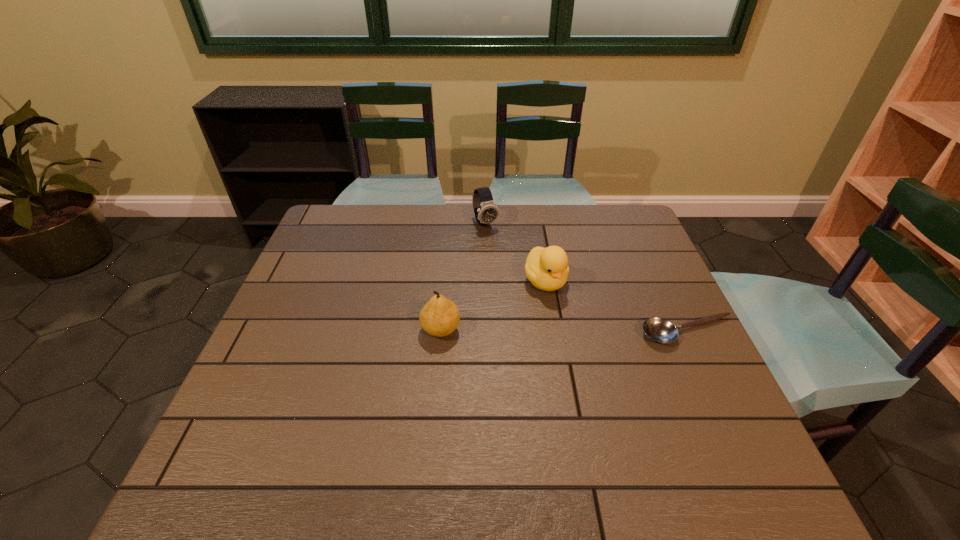
This screenshot has width=960, height=540. I want to click on blank space at the right edge of the desktop, so click(x=706, y=376).

In the image, there is a desktop. Where is `vacant region at the far right corner`? The width and height of the screenshot is (960, 540). vacant region at the far right corner is located at coordinates (618, 211).

At what (x,y) coordinates should I click in order to perform the action: click on free area in between the third object from left to right and the farthest object. Please return your answer as a coordinate pair (x, y). This screenshot has width=960, height=540. Looking at the image, I should click on (516, 252).

At what (x,y) coordinates should I click in order to perform the action: click on free point between the farthest object and the rightmost object. Please return your answer as a coordinate pair (x, y). Looking at the image, I should click on (587, 278).

Identify the location of free spot between the pear and the farthest object. (463, 276).

Locate an element on the screen. Image resolution: width=960 pixels, height=540 pixels. blank region between the rightmost object and the pear is located at coordinates (564, 331).

I want to click on unoccupied position between the shortest object and the farthest object, so click(x=587, y=278).

You are a GUI agent. You are given a task and a screenshot of the screen. Output one action in this format:
    pyautogui.click(x=<x>, y=<y>)
    Task: Click on the free space between the watch and the leftmost object
    The height and width of the screenshot is (540, 960).
    Given the screenshot: What is the action you would take?
    pyautogui.click(x=463, y=276)

The width and height of the screenshot is (960, 540). Find the location of `vacant space that is in between the rightmost object and the watch`. vacant space that is in between the rightmost object and the watch is located at coordinates (587, 278).

At what (x,y) coordinates should I click in order to perform the action: click on vacant space that is in between the watch and the shortest object. Please return your answer as a coordinate pair (x, y). Looking at the image, I should click on (587, 278).